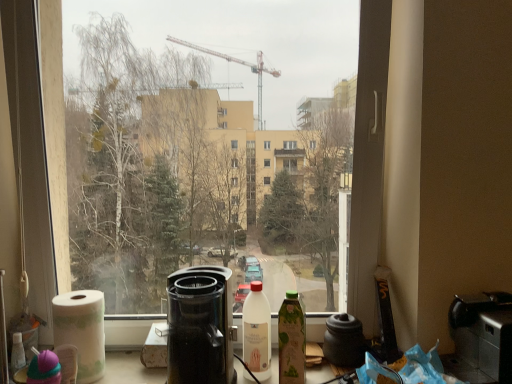
The height and width of the screenshot is (384, 512). What do you see at coordinates (344, 341) in the screenshot?
I see `matte black coffeepot at center` at bounding box center [344, 341].

Describe the element at coordinates (481, 338) in the screenshot. I see `black plastic toaster at lower right, the 1th appliance in the right-to-left sequence` at that location.

The width and height of the screenshot is (512, 384). What do you see at coordinates (200, 326) in the screenshot? I see `black plastic coffee maker at center, which ranks as the second appliance in right-to-left order` at bounding box center [200, 326].

What is the approximate width of green glass bottle at center, the second bottle in the left-to-right sequence?

7.06 centimeters.

Find the location of a particular element. The width and height of the screenshot is (512, 384). white matte bottle at center, which is the 2th bottle from right to left is located at coordinates (257, 332).

In the scene shown: Who is taller, green glass bottle at center, the second bottle in the left-to-right sequence, or white matte bottle at center, the 1th bottle viewed from the left?

white matte bottle at center, the 1th bottle viewed from the left, is taller.

Between green glass bottle at center, which is the 1th bottle in right-to-left order, and white matte bottle at center, which is the 2th bottle from right to left, which one has larger size?

Bigger between the two is white matte bottle at center, which is the 2th bottle from right to left.

In the scene shown: From the image's perspective, between green glass bottle at center, the second bottle in the left-to-right sequence, and white matte bottle at center, the 1th bottle viewed from the left, which one is located above?

white matte bottle at center, the 1th bottle viewed from the left, appears higher in the image.

Considering the positions of points (58, 325) and (220, 332), is point (58, 325) farther from camera compared to point (220, 332)?

Yes, point (58, 325) is behind point (220, 332).

The height and width of the screenshot is (384, 512). Find the location of `paper towel on the left of black plastic coffee maker at center, which ranks as the second appliance in right-to-left order`. paper towel on the left of black plastic coffee maker at center, which ranks as the second appliance in right-to-left order is located at coordinates (82, 330).

From the image's perspective, is black plastic toaster at lower right, which appears as the second appliance when viewed from the left, above or below transparent glass window at center?

From the image's perspective, black plastic toaster at lower right, which appears as the second appliance when viewed from the left, appears below transparent glass window at center.

Is black plastic toaster at lower right, which appears as the second appliance when viewed from the left, positioned beyond the bounds of transparent glass window at center?

black plastic toaster at lower right, which appears as the second appliance when viewed from the left, is positioned outside transparent glass window at center.

Considering the relative sizes of black plastic toaster at lower right, which appears as the second appliance when viewed from the left, and transparent glass window at center in the image provided, is black plastic toaster at lower right, which appears as the second appliance when viewed from the left, wider than transparent glass window at center?

Incorrect, the width of black plastic toaster at lower right, which appears as the second appliance when viewed from the left, does not surpass that of transparent glass window at center.

Does black plastic toaster at lower right, the 1th appliance in the right-to-left sequence, turn towards transparent glass window at center?

No, black plastic toaster at lower right, the 1th appliance in the right-to-left sequence, does not turn towards transparent glass window at center.

Considering the points (280, 336) and (350, 321), which point is behind, point (280, 336) or point (350, 321)?

Positioned behind is point (350, 321).

What's the angular difference between green glass bottle at center, the second bottle in the left-to-right sequence, and matte black coffeepot at center's facing directions?

They differ by 0.733 degrees in their facing directions.

From the image's perspective, is green glass bottle at center, the second bottle in the left-to-right sequence, on top of matte black coffeepot at center?

Correct, green glass bottle at center, the second bottle in the left-to-right sequence, appears higher than matte black coffeepot at center in the image.

From the image's perspective, count 1st bottles upward from the matte black coffeepot at center and point to it. Please provide its 2D coordinates.

[(291, 340)]

From the image's perspective, does transparent glass window at center appear lower than black plastic coffee maker at center, which ranks as the 1th appliance in left-to-right order?

Actually, transparent glass window at center appears above black plastic coffee maker at center, which ranks as the 1th appliance in left-to-right order, in the image.

Can you confirm if transparent glass window at center is thinner than black plastic coffee maker at center, which ranks as the second appliance in right-to-left order?

Indeed, transparent glass window at center has a lesser width compared to black plastic coffee maker at center, which ranks as the second appliance in right-to-left order.

Who is bigger, transparent glass window at center or black plastic coffee maker at center, which ranks as the 1th appliance in left-to-right order?

With larger size is transparent glass window at center.

Between transparent glass window at center and black plastic coffee maker at center, which ranks as the 1th appliance in left-to-right order, which one is positioned in front?

black plastic coffee maker at center, which ranks as the 1th appliance in left-to-right order, is closer to the camera.

Is point (212, 277) more distant than point (366, 344)?

No, it is in front of (366, 344).

Is black plastic coffee maker at center, which ranks as the second appliance in right-to-left order, looking in the opposite direction of matte black coffeepot at center?

No, black plastic coffee maker at center, which ranks as the second appliance in right-to-left order, is not facing the opposite direction of matte black coffeepot at center.

From their relative heights in the image, would you say black plastic coffee maker at center, which ranks as the 1th appliance in left-to-right order, is taller or shorter than matte black coffeepot at center?

In the image, black plastic coffee maker at center, which ranks as the 1th appliance in left-to-right order, appears to be taller than matte black coffeepot at center.

From a real-world perspective, is black plastic coffee maker at center, which ranks as the second appliance in right-to-left order, on top of green glass bottle at center, the second bottle in the left-to-right sequence?

Indeed, from a real-world perspective, black plastic coffee maker at center, which ranks as the second appliance in right-to-left order, stands above green glass bottle at center, the second bottle in the left-to-right sequence.

Are black plastic coffee maker at center, which ranks as the second appliance in right-to-left order, and green glass bottle at center, the second bottle in the left-to-right sequence, beside each other?

black plastic coffee maker at center, which ranks as the second appliance in right-to-left order, and green glass bottle at center, the second bottle in the left-to-right sequence, are not in contact.

Is black plastic coffee maker at center, which ranks as the 1th appliance in left-to-right order, situated inside green glass bottle at center, the second bottle in the left-to-right sequence, or outside?

black plastic coffee maker at center, which ranks as the 1th appliance in left-to-right order, is not enclosed by green glass bottle at center, the second bottle in the left-to-right sequence.

Is black plastic coffee maker at center, which ranks as the second appliance in right-to-left order, at the left side of green glass bottle at center, which is the 1th bottle in right-to-left order?

Indeed, black plastic coffee maker at center, which ranks as the second appliance in right-to-left order, is positioned on the left side of green glass bottle at center, which is the 1th bottle in right-to-left order.

Where is `bottle lying on the left of green glass bottle at center, which is the 1th bottle in right-to-left order`? bottle lying on the left of green glass bottle at center, which is the 1th bottle in right-to-left order is located at coordinates (257, 332).

In order to click on appliance that is the 1st object to the right of the white paper towel at lower left, starting at the anchor in this screenshot , I will do `click(200, 326)`.

When comparing their distances from transparent glass window at center, does black plastic toaster at lower right, the 1th appliance in the right-to-left sequence, or white matte bottle at center, which is the 2th bottle from right to left, seem further?

white matte bottle at center, which is the 2th bottle from right to left, is positioned further to the anchor transparent glass window at center.

Based on their spatial positions, is matte black coffeepot at center or green glass bottle at center, the second bottle in the left-to-right sequence, further from black plastic coffee maker at center, which ranks as the 1th appliance in left-to-right order?

matte black coffeepot at center is further to black plastic coffee maker at center, which ranks as the 1th appliance in left-to-right order.

Based on their spatial positions, is black plastic toaster at lower right, which appears as the second appliance when viewed from the left, or matte black coffeepot at center closer to black plastic coffee maker at center, which ranks as the 1th appliance in left-to-right order?

matte black coffeepot at center is positioned closer to the anchor black plastic coffee maker at center, which ranks as the 1th appliance in left-to-right order.

Based on their spatial positions, is white paper towel at lower left or matte black coffeepot at center closer to green glass bottle at center, the second bottle in the left-to-right sequence?

Based on the image, matte black coffeepot at center appears to be nearer to green glass bottle at center, the second bottle in the left-to-right sequence.

Estimate the real-world distances between objects in this image. Which object is closer to white matte bottle at center, the 1th bottle viewed from the left, black plastic toaster at lower right, the 1th appliance in the right-to-left sequence, or matte black coffeepot at center?

Based on the image, matte black coffeepot at center appears to be nearer to white matte bottle at center, the 1th bottle viewed from the left.

From the image, which object appears to be nearer to white matte bottle at center, which is the 2th bottle from right to left, matte black coffeepot at center or white paper towel at lower left?

matte black coffeepot at center lies closer to white matte bottle at center, which is the 2th bottle from right to left, than the other object.

Which object lies further to the anchor point transparent glass window at center, black plastic toaster at lower right, the 1th appliance in the right-to-left sequence, or black plastic coffee maker at center, which ranks as the second appliance in right-to-left order?

black plastic toaster at lower right, the 1th appliance in the right-to-left sequence, is further to transparent glass window at center.

Considering their positions, is black plastic toaster at lower right, the 1th appliance in the right-to-left sequence, positioned closer to transparent glass window at center than matte black coffeepot at center?

black plastic toaster at lower right, the 1th appliance in the right-to-left sequence, lies closer to transparent glass window at center than the other object.

At what (x,y) coordinates should I click in order to perform the action: click on bay window between white paper towel at lower left and black plastic toaster at lower right, the 1th appliance in the right-to-left sequence. Please return your answer as a coordinate pair (x, y). The width and height of the screenshot is (512, 384). Looking at the image, I should click on (206, 133).

What are the coordinates of `appliance located between transparent glass window at center and black plastic toaster at lower right, which appears as the second appliance when viewed from the left, in the left-right direction` in the screenshot? It's located at (200, 326).

I want to click on appliance located between white paper towel at lower left and white matte bottle at center, which is the 2th bottle from right to left, in the left-right direction, so [200, 326].

The height and width of the screenshot is (384, 512). Identify the location of bottle between transparent glass window at center and green glass bottle at center, the second bottle in the left-to-right sequence, from top to bottom. (257, 332).